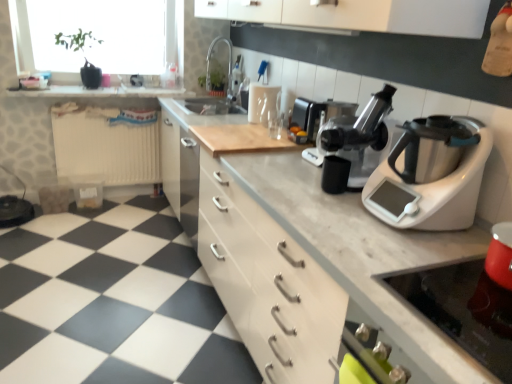
Question: In terms of width, does white marble countertop at center look wider or thinner when compared to black plastic juicer at center?

Choices:
 (A) thin
 (B) wide

Answer: (B)

Question: From the image's perspective, is white marble countertop at center positioned above or below black plastic juicer at center?

Choices:
 (A) above
 (B) below

Answer: (B)

Question: Estimate the real-world distances between objects in this image. Which object is farther from the black plastic juicer at center?

Choices:
 (A) matte silver sink at upper center
 (B) silver metallic food processor at right
 (C) white marble cutting board at upper center
 (D) metallic silver gas stove at lower right
 (E) white marble countertop at center

Answer: (C)

Question: Estimate the real-world distances between objects in this image. Which object is closer to the matte silver sink at upper center?

Choices:
 (A) sleek silver coffee machine at center
 (B) silver metallic food processor at right
 (C) black plastic juicer at center
 (D) white plastic radiator at lower left
 (E) white marble countertop at center

Answer: (D)